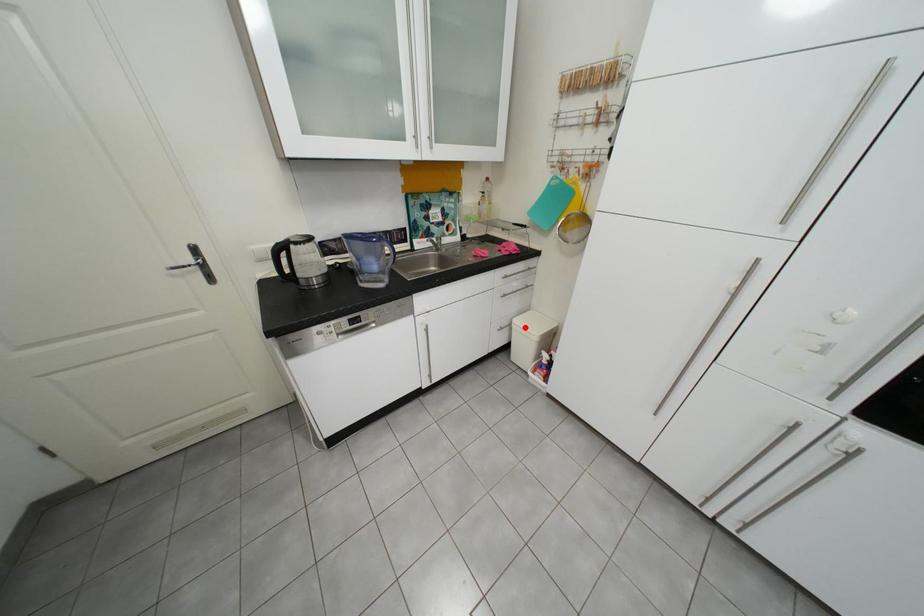
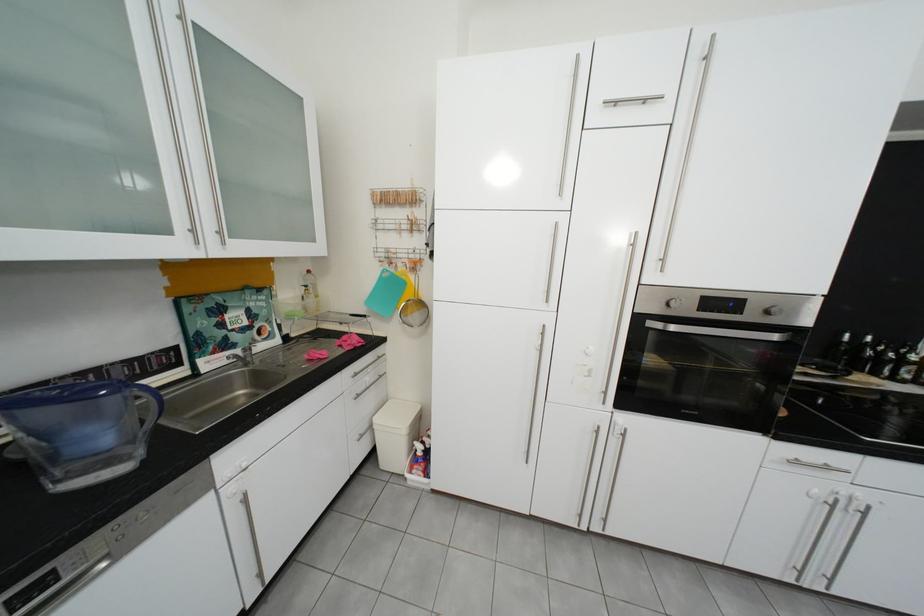
Question: I am providing you with two images of the same scene from different viewpoints. Given a red point in image1, look at the same physical point in image2. Is it:

Choices:
 (A) Closer to the viewpoint
 (B) Farther from the viewpoint

Answer: (B)